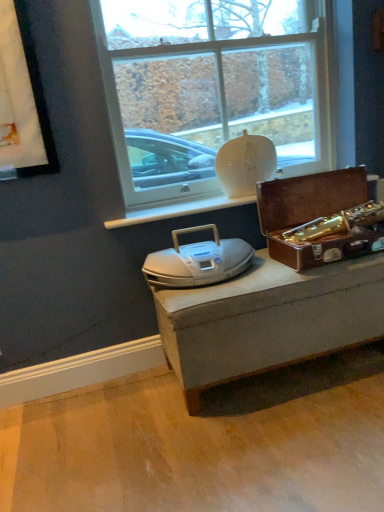
Question: Considering the positions of shiny brown suitcase at right and white matte vase at upper center in the image, is shiny brown suitcase at right wider or thinner than white matte vase at upper center?

Choices:
 (A) wide
 (B) thin

Answer: (A)

Question: Based on their sizes in the image, would you say shiny brown suitcase at right is bigger or smaller than white matte vase at upper center?

Choices:
 (A) small
 (B) big

Answer: (B)

Question: Which of these objects is positioned closest to the white plastic stereo at center?

Choices:
 (A) shiny brown suitcase at right
 (B) white matte vase at upper center

Answer: (A)

Question: Which is farther from the shiny brown suitcase at right?

Choices:
 (A) white matte vase at upper center
 (B) white plastic stereo at center

Answer: (A)